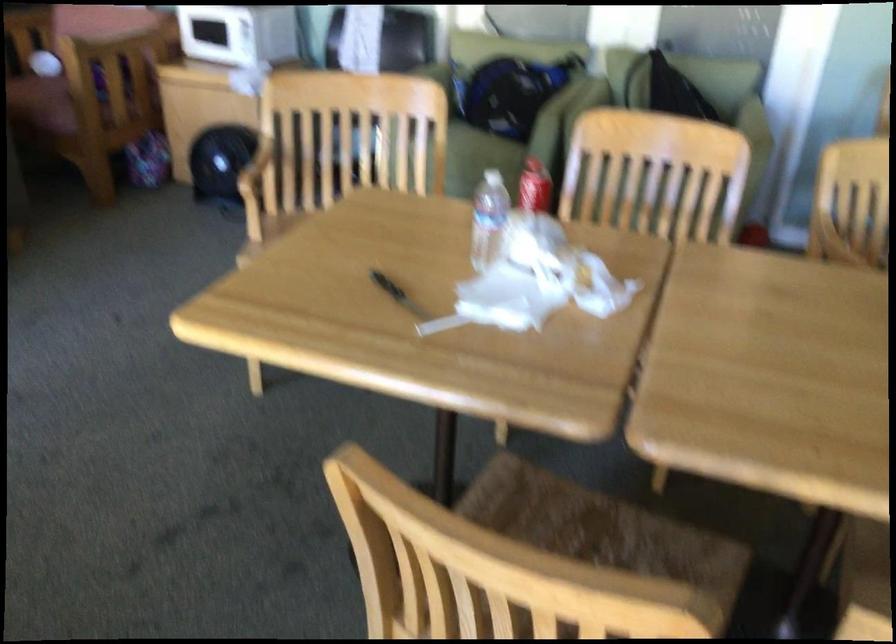
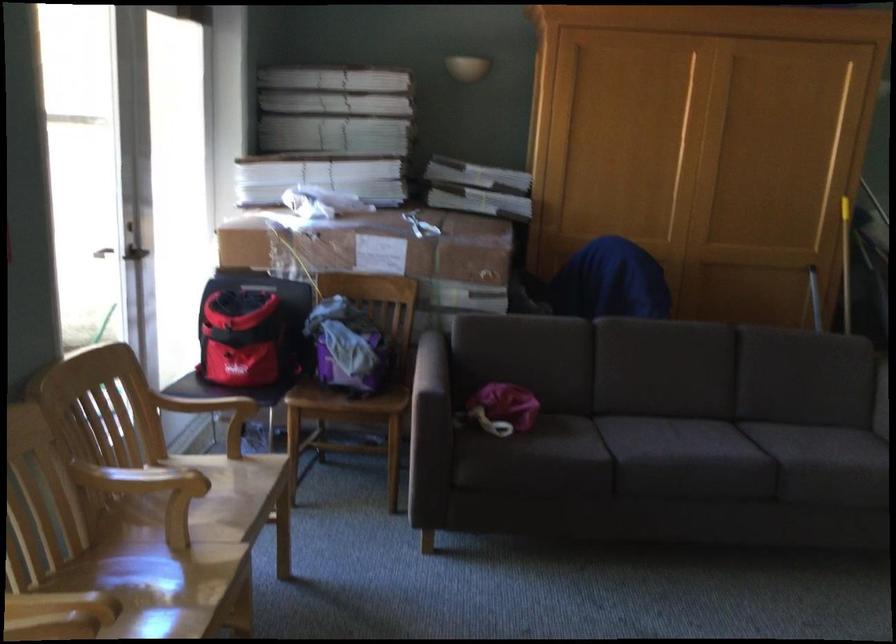
Question: The camera is either moving clockwise (left) or counter-clockwise (right) around the object. The first image is from the beginning of the video and the second image is from the end. Is the camera moving left or right when shooting the video?

Choices:
 (A) Left
 (B) Right

Answer: (B)